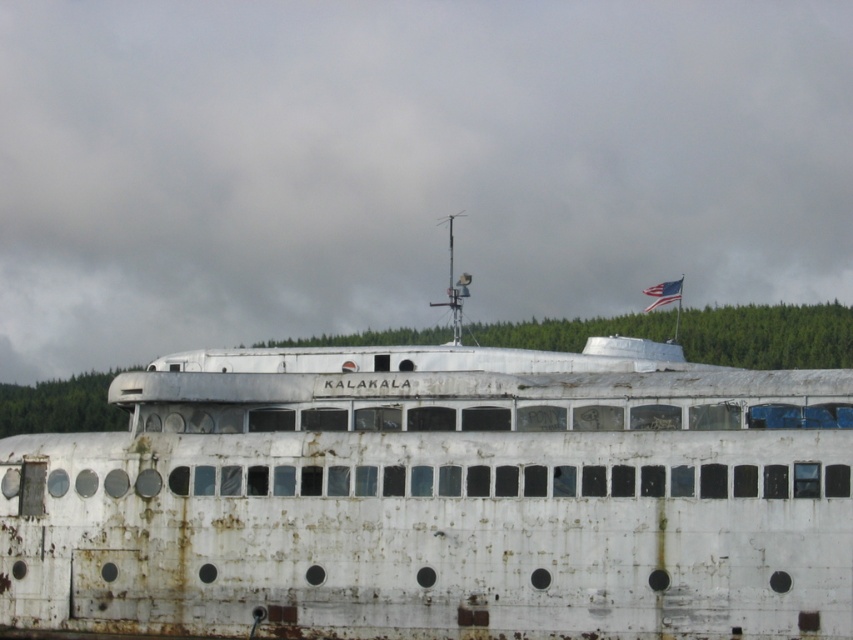
Between rusty white ship at center and american flag at upper center, which one has less height?

american flag at upper center is shorter.

The width and height of the screenshot is (853, 640). In order to click on rusty white ship at center in this screenshot , I will do `click(440, 497)`.